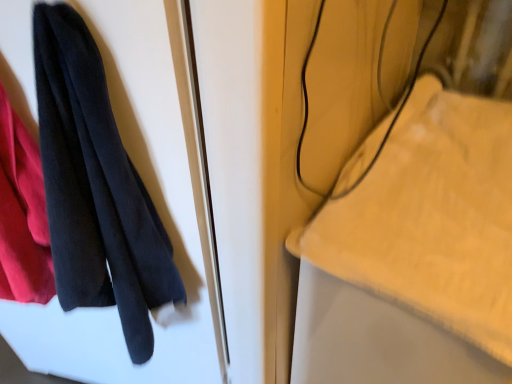
Locate an element on the screen. The width and height of the screenshot is (512, 384). yellow plush towel at upper right is located at coordinates (431, 218).

The image size is (512, 384). What do you see at coordinates (431, 218) in the screenshot?
I see `yellow plush towel at upper right` at bounding box center [431, 218].

Image resolution: width=512 pixels, height=384 pixels. What are the coordinates of `black cotton towel at left` in the screenshot? It's located at (95, 187).

The height and width of the screenshot is (384, 512). Describe the element at coordinates (95, 187) in the screenshot. I see `black cotton towel at left` at that location.

Where is `yellow plush towel at upper right`? yellow plush towel at upper right is located at coordinates (431, 218).

Which object is positioned more to the right, yellow plush towel at upper right or black cotton towel at left?

From the viewer's perspective, yellow plush towel at upper right appears more on the right side.

Which object is closer to the camera, yellow plush towel at upper right or black cotton towel at left?

black cotton towel at left is more forward.

Is point (329, 229) positioned after point (142, 313)?

No, (329, 229) is in front of (142, 313).

From the image's perspective, is yellow plush towel at upper right located above black cotton towel at left?

No, from the image's perspective, yellow plush towel at upper right is not on top of black cotton towel at left.

From a real-world perspective, which object rests below the other?

From a 3D spatial view, yellow plush towel at upper right is below.

Considering the relative sizes of yellow plush towel at upper right and black cotton towel at left in the image provided, is yellow plush towel at upper right thinner than black cotton towel at left?

Incorrect, the width of yellow plush towel at upper right is not less than that of black cotton towel at left.

Considering the relative sizes of yellow plush towel at upper right and black cotton towel at left in the image provided, is yellow plush towel at upper right taller than black cotton towel at left?

Yes, yellow plush towel at upper right is taller than black cotton towel at left.

Does yellow plush towel at upper right have a larger size compared to black cotton towel at left?

Yes.

Is black cotton towel at left inside yellow plush towel at upper right?

No, black cotton towel at left is not inside yellow plush towel at upper right.

Is yellow plush towel at upper right not near black cotton towel at left?

yellow plush towel at upper right is actually quite close to black cotton towel at left.

Could you tell me if yellow plush towel at upper right is facing black cotton towel at left?

No.

Can you tell me how much yellow plush towel at upper right and black cotton towel at left differ in facing direction?

There is a 76.5-degree angle between the facing directions of yellow plush towel at upper right and black cotton towel at left.

Locate an element on the screen. Image resolution: width=512 pixels, height=384 pixels. cloth on the right of black cotton towel at left is located at coordinates (431, 218).

Considering the relative positions of black cotton towel at left and yellow plush towel at upper right in the image provided, is black cotton towel at left to the right of yellow plush towel at upper right from the viewer's perspective?

In fact, black cotton towel at left is to the left of yellow plush towel at upper right.

Does black cotton towel at left come behind yellow plush towel at upper right?

That is False.

Does point (73, 125) come closer to viewer compared to point (469, 135)?

Yes, point (73, 125) is closer to viewer.

From the image's perspective, does black cotton towel at left appear lower than yellow plush towel at upper right?

Actually, black cotton towel at left appears above yellow plush towel at upper right in the image.

From a real-world perspective, is black cotton towel at left physically located above or below yellow plush towel at upper right?

black cotton towel at left is above yellow plush towel at upper right.

Is black cotton towel at left thinner than yellow plush towel at upper right?

Yes, black cotton towel at left is thinner than yellow plush towel at upper right.

Looking at this image, can you confirm if black cotton towel at left is shorter than yellow plush towel at upper right?

Yes, black cotton towel at left is shorter than yellow plush towel at upper right.

Is black cotton towel at left smaller than yellow plush towel at upper right?

Yes.

Choose the correct answer: Is black cotton towel at left inside yellow plush towel at upper right or outside it?

black cotton towel at left lies outside yellow plush towel at upper right.

Is black cotton towel at left not close to yellow plush towel at upper right?

black cotton towel at left is near yellow plush towel at upper right, not far away.

Is black cotton towel at left facing towards yellow plush towel at upper right?

No, black cotton towel at left is not oriented towards yellow plush towel at upper right.

Locate an element on the screen. The image size is (512, 384). cloth located below the black cotton towel at left (from the image's perspective) is located at coordinates (431, 218).

The width and height of the screenshot is (512, 384). Find the location of `towel that appears in front of the yellow plush towel at upper right`. towel that appears in front of the yellow plush towel at upper right is located at coordinates (95, 187).

At what (x,y) coordinates should I click in order to perform the action: click on towel on the left of the yellow plush towel at upper right. Please return your answer as a coordinate pair (x, y). This screenshot has height=384, width=512. Looking at the image, I should click on (95, 187).